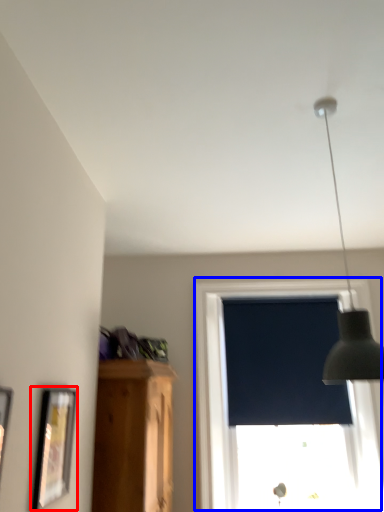
Question: Which object is further to the camera taking this photo, picture frame (highlighted by a red box) or window (highlighted by a blue box)?

Choices:
 (A) picture frame
 (B) window

Answer: (B)